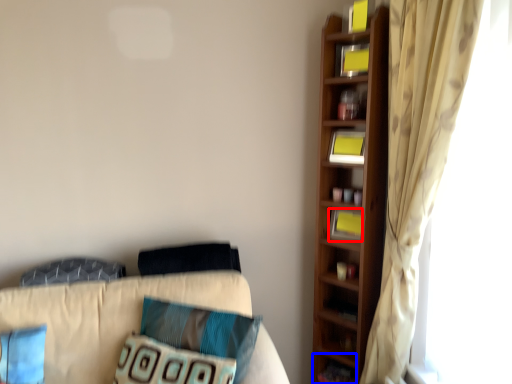
Question: Which object appears closest to the camera in this image, book (highlighted by a red box) or cabinet (highlighted by a blue box)?

Choices:
 (A) book
 (B) cabinet

Answer: (A)